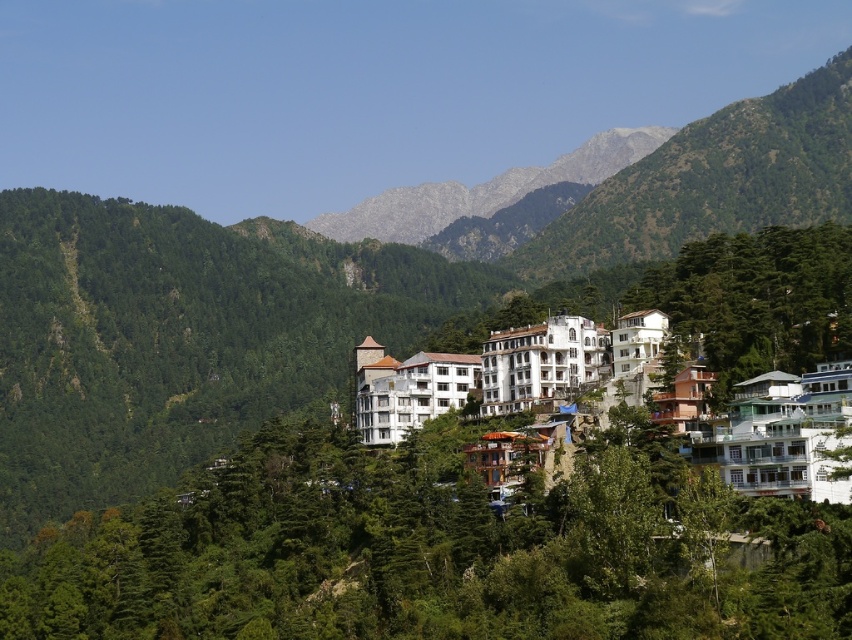
Does green leafy tree at center have a lesser width compared to white stone building at center?

No, green leafy tree at center is not thinner than white stone building at center.

Is green leafy tree at center closer to the viewer compared to white stone building at center?

Yes.

What do you see at coordinates (432, 550) in the screenshot? I see `green leafy tree at center` at bounding box center [432, 550].

You are a GUI agent. You are given a task and a screenshot of the screen. Output one action in this format:
    pyautogui.click(x=<x>, y=<y>)
    Task: Click on the green leafy tree at center
    Image resolution: width=852 pixels, height=640 pixels.
    Given the screenshot: What is the action you would take?
    pyautogui.click(x=432, y=550)

Can you confirm if green leafy tree at center-right is bigger than white glossy building at lower right?

Yes, green leafy tree at center-right is bigger than white glossy building at lower right.

Image resolution: width=852 pixels, height=640 pixels. What do you see at coordinates (753, 300) in the screenshot? I see `green leafy tree at center-right` at bounding box center [753, 300].

What do you see at coordinates (753, 300) in the screenshot? This screenshot has height=640, width=852. I see `green leafy tree at center-right` at bounding box center [753, 300].

Where is `green leafy tree at center-right`? The height and width of the screenshot is (640, 852). green leafy tree at center-right is located at coordinates (753, 300).

Is green leafy tree at center smaller than white glossy building at lower right?

No.

Which of these two, green leafy tree at center or white glossy building at lower right, stands taller?

green leafy tree at center is taller.

Who is more distant from viewer, (x=505, y=541) or (x=770, y=484)?

The point (x=505, y=541) is behind.

You are a GUI agent. You are given a task and a screenshot of the screen. Output one action in this format:
    pyautogui.click(x=<x>, y=<y>)
    Task: Click on the green leafy tree at center
    The height and width of the screenshot is (640, 852).
    Given the screenshot: What is the action you would take?
    pyautogui.click(x=432, y=550)